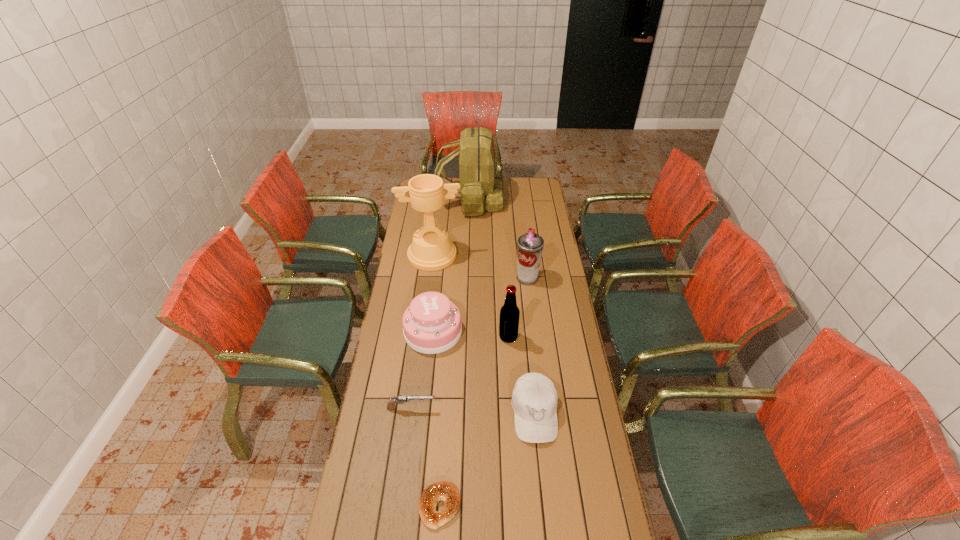
Where is `free point between the gun and the aerosol can`? free point between the gun and the aerosol can is located at coordinates (469, 343).

You are a GUI agent. You are given a task and a screenshot of the screen. Output one action in this format:
    pyautogui.click(x=<x>, y=<y>)
    Task: Click on the free point between the backpack and the aerosol can
    The height and width of the screenshot is (540, 960).
    Given the screenshot: What is the action you would take?
    pyautogui.click(x=499, y=239)

The width and height of the screenshot is (960, 540). In order to click on unoccupied area between the shortest object and the fourth shortest object in this screenshot , I will do `click(437, 419)`.

Locate an element on the screen. vacant space in between the nearest object and the aerosol can is located at coordinates point(484,392).

This screenshot has width=960, height=540. Identify the location of vacant region between the aerosol can and the gun. (469, 343).

This screenshot has width=960, height=540. What are the coordinates of `vacant region between the aerosol can and the gun` in the screenshot? It's located at (469, 343).

Identify the location of vacant space that's between the nearest object and the seventh tallest object. The height and width of the screenshot is (540, 960). (425, 457).

In order to click on object that can be found as the sixth closest to the aerosol can in this screenshot , I will do `click(401, 399)`.

Locate an element on the screen. The height and width of the screenshot is (540, 960). the fourth closest object to the cake is located at coordinates (431, 250).

The height and width of the screenshot is (540, 960). I want to click on vacant space that satisfies the following two spatial constraints: 1. on the back side of the cake; 2. on the right side of the aerosol can, so click(439, 278).